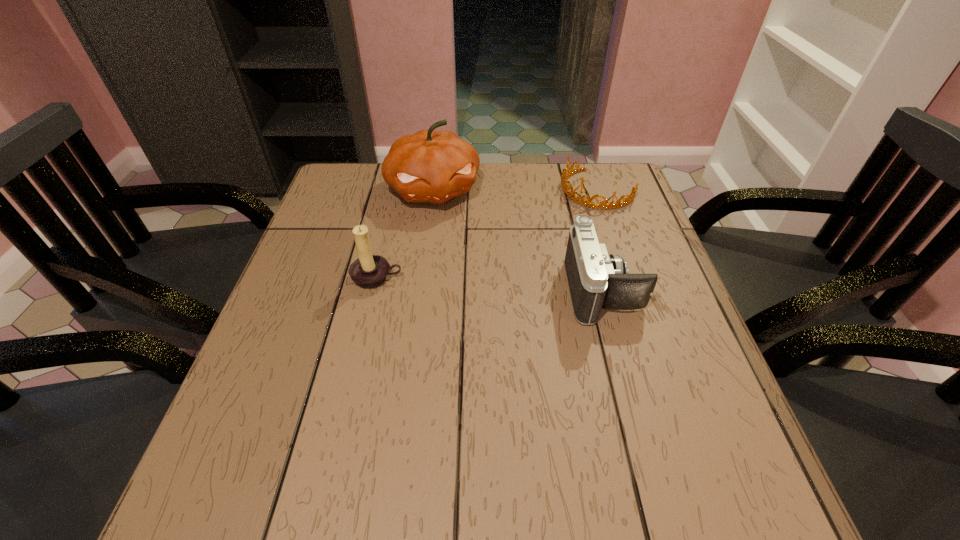
Where is `free spot on the desktop that is between the candle holder and the camera and is positioned on the front-facing side of the shortest object`? free spot on the desktop that is between the candle holder and the camera and is positioned on the front-facing side of the shortest object is located at coordinates (485, 284).

Where is `vacant space on the desktop that is between the candle holder and the camera and is positioned on the front face of the tallest object`? The height and width of the screenshot is (540, 960). vacant space on the desktop that is between the candle holder and the camera and is positioned on the front face of the tallest object is located at coordinates (466, 282).